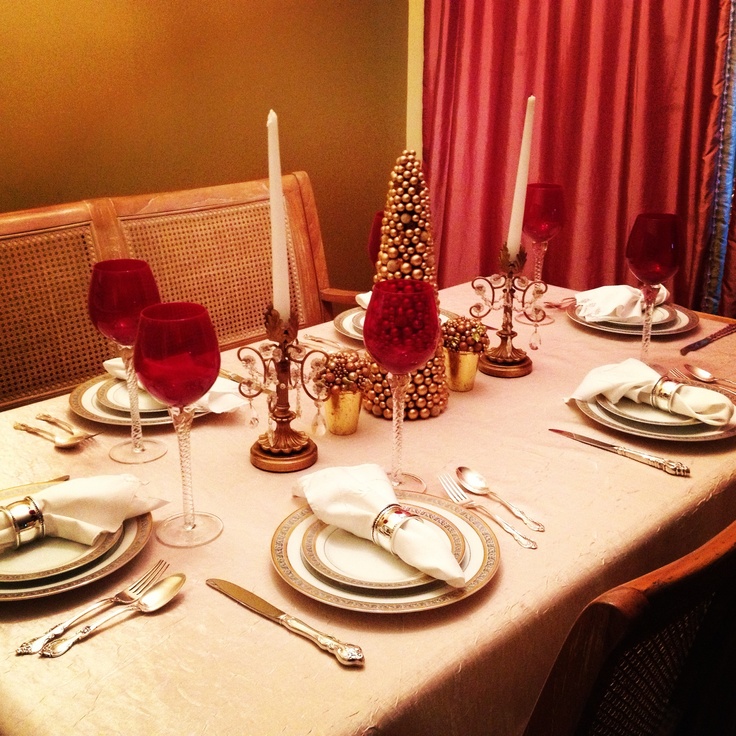
Identify the location of wine glasses. (155, 374), (115, 311), (383, 338), (544, 210), (651, 257), (375, 244).